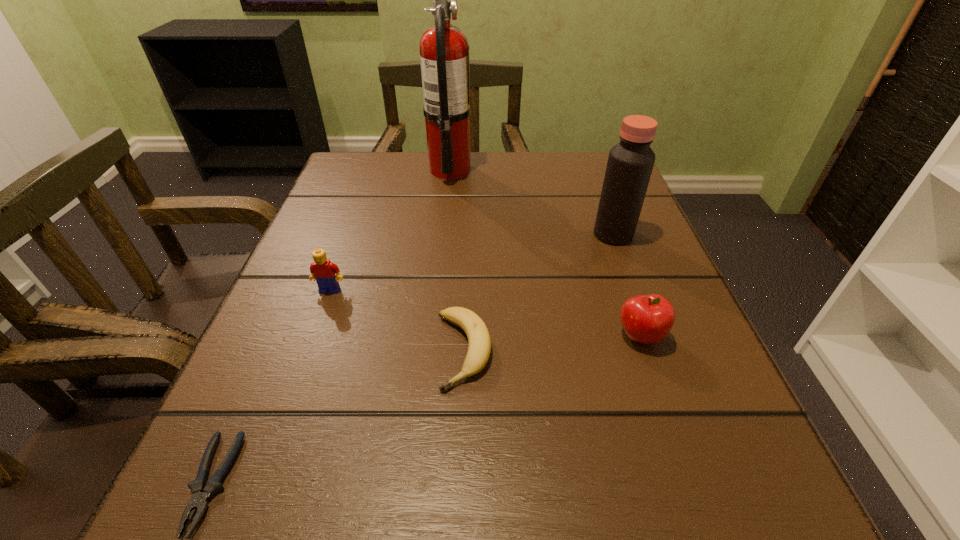
Identify the location of vacant space that satisfies the following two spatial constraints: 1. on the back side of the second shortest object; 2. on the nozzle side of the tallest object. The height and width of the screenshot is (540, 960). click(469, 170).

You are a GUI agent. You are given a task and a screenshot of the screen. Output one action in this format:
    pyautogui.click(x=<x>, y=<y>)
    Task: Click on the free spot that satisfies the following two spatial constraints: 1. on the face of the apple; 2. on the left side of the Lego
    This screenshot has width=960, height=540.
    Given the screenshot: What is the action you would take?
    point(313,337)

Identify the location of vacant region that satisfies the following two spatial constraints: 1. on the back side of the banana; 2. on the left side of the apple. (464, 337).

I want to click on vacant space that satisfies the following two spatial constraints: 1. on the nozzle side of the farthest object; 2. on the right side of the apple, so click(432, 337).

This screenshot has width=960, height=540. Find the location of `free region that satisfies the following two spatial constraints: 1. on the back side of the second shortest object; 2. on the right side of the fifth shortest object`. free region that satisfies the following two spatial constraints: 1. on the back side of the second shortest object; 2. on the right side of the fifth shortest object is located at coordinates (468, 234).

This screenshot has height=540, width=960. In order to click on free space that satisfies the following two spatial constraints: 1. on the nozzle side of the tallest object; 2. on the face of the fifth object from right to left in this screenshot , I will do `click(437, 290)`.

Where is `free space that satisfies the following two spatial constraints: 1. on the nozzle side of the second tallest object; 2. on the left side of the tallest object`? This screenshot has height=540, width=960. free space that satisfies the following two spatial constraints: 1. on the nozzle side of the second tallest object; 2. on the left side of the tallest object is located at coordinates (444, 234).

What are the coordinates of `vacant position in the image that satisfies the following two spatial constraints: 1. on the nozzle side of the fire extinguisher; 2. on the left side of the vinegar` in the screenshot? It's located at (444, 234).

This screenshot has height=540, width=960. What are the coordinates of `free point that satisfies the following two spatial constraints: 1. on the nozzle side of the farthest object; 2. on the left side of the apple` in the screenshot? It's located at (432, 337).